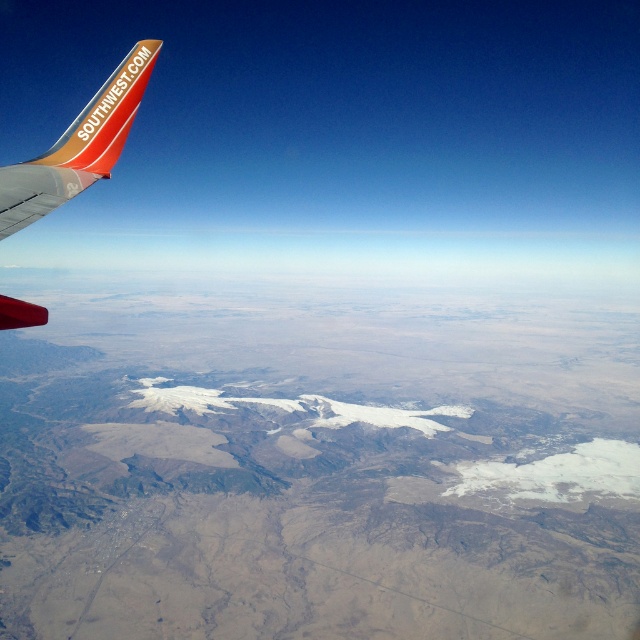
Question: Observing the image, what is the correct spatial positioning of matte orange winglet at upper left in reference to orange matte airplane winglet at upper left?

Choices:
 (A) below
 (B) above

Answer: (A)

Question: Is matte orange winglet at upper left to the right of orange matte airplane winglet at upper left from the viewer's perspective?

Choices:
 (A) yes
 (B) no

Answer: (A)

Question: Which object appears farthest from the camera in this image?

Choices:
 (A) matte orange winglet at upper left
 (B) orange matte airplane winglet at upper left

Answer: (B)

Question: Can you confirm if matte orange winglet at upper left is positioned to the left of orange matte airplane winglet at upper left?

Choices:
 (A) yes
 (B) no

Answer: (B)

Question: Among these objects, which one is nearest to the camera?

Choices:
 (A) matte orange winglet at upper left
 (B) orange matte airplane winglet at upper left

Answer: (A)